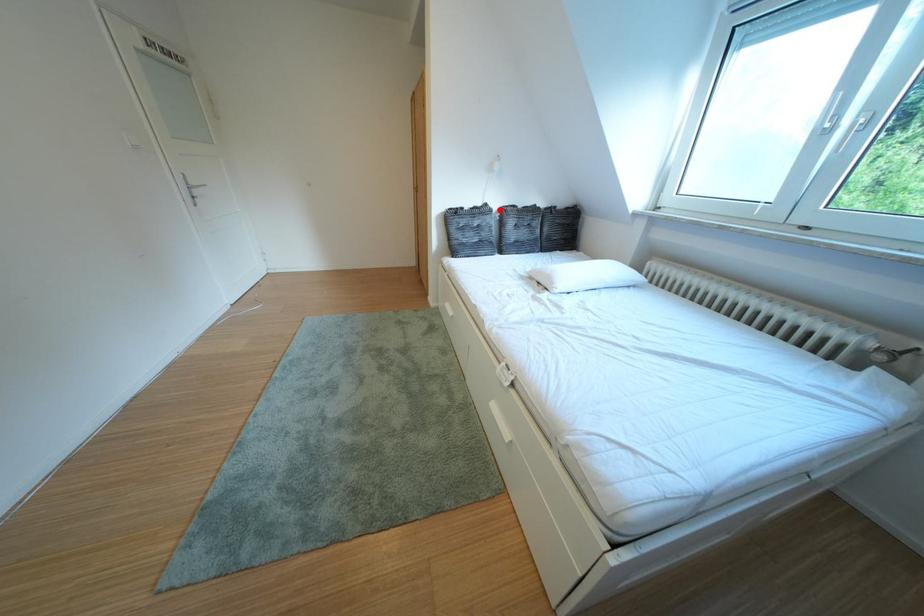
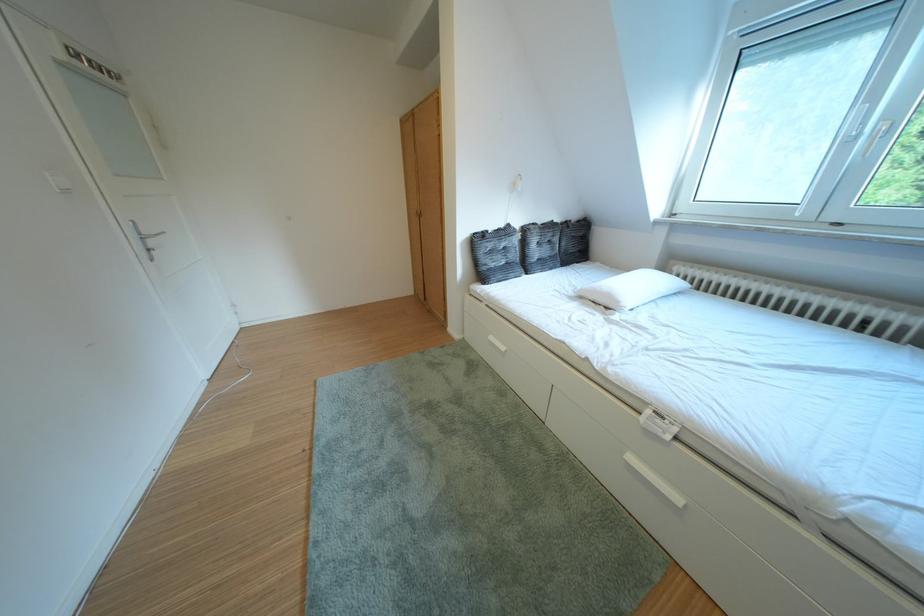
Find the pixel in the second image that matches the highlighted location in the first image.

(523, 230)